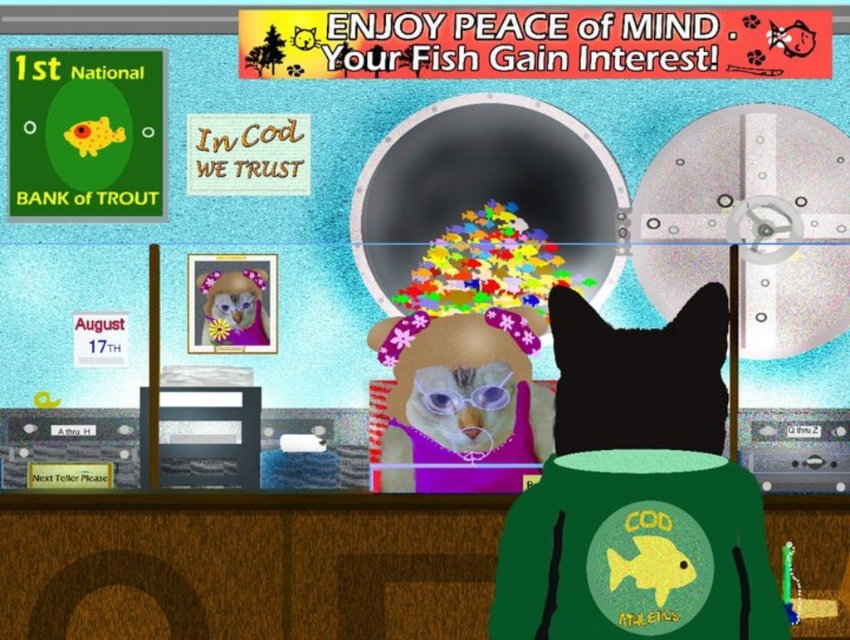
Which is above, black fur cat at center or fluffy pink teddy bear at center?

Positioned higher is fluffy pink teddy bear at center.

The image size is (850, 640). What do you see at coordinates (639, 376) in the screenshot? I see `black fur cat at center` at bounding box center [639, 376].

Identify the location of black fur cat at center. (639, 376).